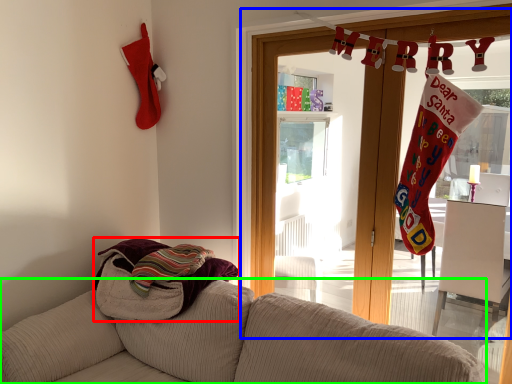
Question: Estimate the real-world distances between objects in this image. Which object is farther from beach towel (highlighted by a red box), window frame (highlighted by a blue box) or studio couch (highlighted by a green box)?

Choices:
 (A) window frame
 (B) studio couch

Answer: (A)